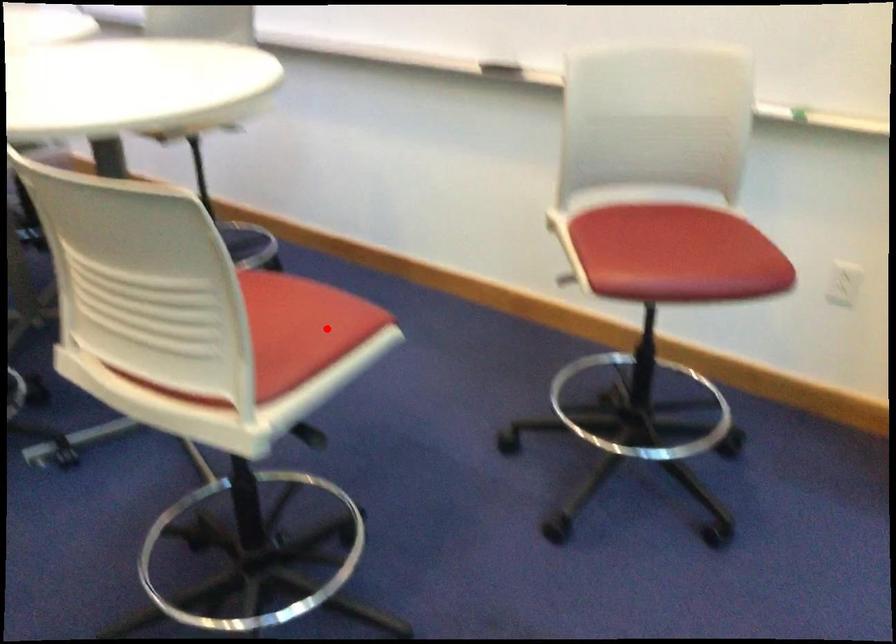
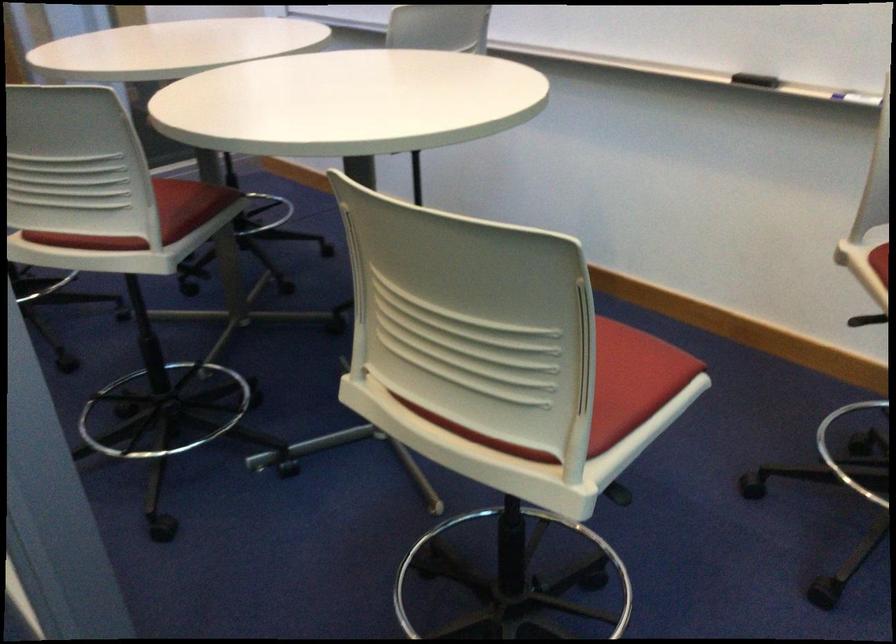
Question: I am providing you with two images of the same scene from different viewpoints. In image1, a red point is highlighted. Considering the same 3D point in image2, which of the following is correct?

Choices:
 (A) It is closer
 (B) It is farther

Answer: (A)